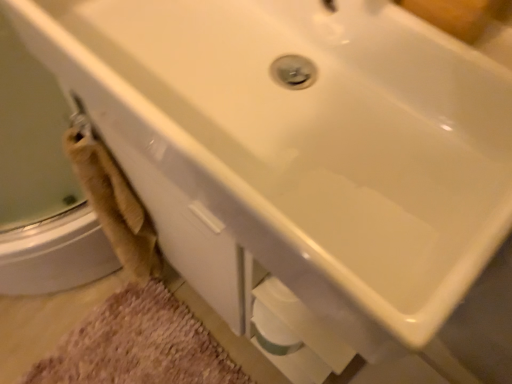
In order to click on free point above beige shaggy bath mat at lower left (from a real-world perspective) in this screenshot , I will do `click(137, 357)`.